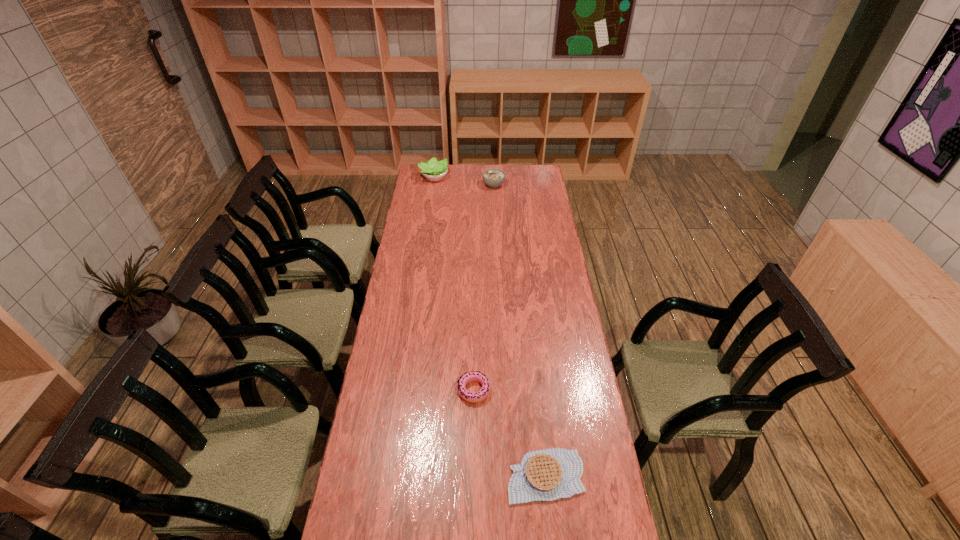
In order to click on the tallest object in this screenshot , I will do `click(434, 170)`.

Find the location of a particular element. The image size is (960, 540). lettuce is located at coordinates (434, 170).

Where is `the second tallest object`? This screenshot has width=960, height=540. the second tallest object is located at coordinates (493, 177).

Where is `doughnut`? doughnut is located at coordinates (473, 397).

Where is `pie`? pie is located at coordinates (543, 475).

Where is `vacant space located 0.170m on the right of the lettuce`? This screenshot has width=960, height=540. vacant space located 0.170m on the right of the lettuce is located at coordinates (x=477, y=177).

Identify the location of free space located 0.350m on the left of the third shortest object. (422, 185).

Where is `free space located on the left of the doughnut`? free space located on the left of the doughnut is located at coordinates (429, 390).

Locate an element on the screen. free location located 0.110m on the back of the nearest object is located at coordinates (540, 417).

Locate an element on the screen. This screenshot has width=960, height=540. lettuce that is at the far edge is located at coordinates (434, 170).